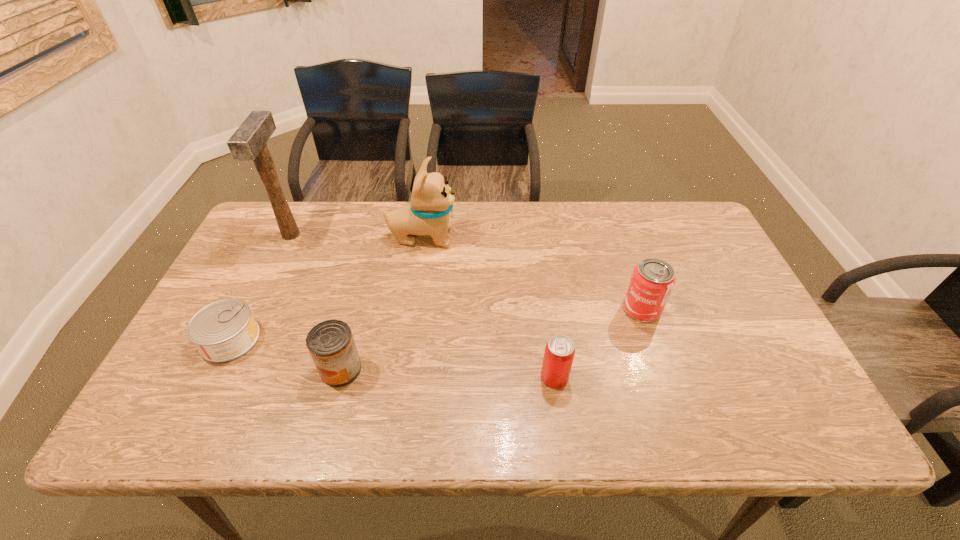
Identify the location of vacant area that lies between the rightmost can and the mallet. The width and height of the screenshot is (960, 540). (467, 272).

This screenshot has height=540, width=960. In order to click on unoccupied area between the mallet and the rightmost can in this screenshot , I will do `click(467, 272)`.

Where is `vacant space that is in between the tallest object and the rightmost object`? vacant space that is in between the tallest object and the rightmost object is located at coordinates (467, 272).

Locate an element on the screen. free space between the rightmost object and the puppy is located at coordinates (532, 273).

Locate an element on the screen. Image resolution: width=960 pixels, height=540 pixels. vacant area that lies between the fifth object from left to right and the puppy is located at coordinates click(x=489, y=307).

You are a GUI agent. You are given a task and a screenshot of the screen. Output one action in this format:
    pyautogui.click(x=<x>, y=<y>)
    Task: Click on the object that is the closest to the second can from right to left
    
    Given the screenshot: What is the action you would take?
    pyautogui.click(x=652, y=280)

Select which object is the fifth closest to the rightmost can. Please provide its 2D coordinates. Your answer should be formatted as a tuple, i.e. [(x, y)], where the tuple contains the x and y coordinates of a point satisfying the conditions above.

[(248, 143)]

Choose which can is the third nearest neighbor to the second can from right to left. Please provide its 2D coordinates. Your answer should be formatted as a tuple, i.e. [(x, y)], where the tuple contains the x and y coordinates of a point satisfying the conditions above.

[(224, 330)]

Select which can appears as the closest to the puppy. Please provide its 2D coordinates. Your answer should be formatted as a tuple, i.e. [(x, y)], where the tuple contains the x and y coordinates of a point satisfying the conditions above.

[(224, 330)]

At what (x,y) coordinates should I click in order to perform the action: click on free location that satisfies the following two spatial constraints: 1. on the face of the puppy; 2. on the back side of the rightmost object. Please return your answer as a coordinate pair (x, y). The image size is (960, 540). Looking at the image, I should click on (412, 309).